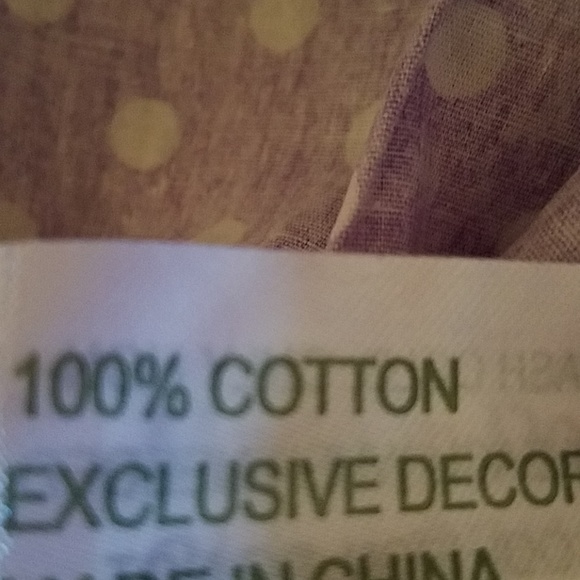
The image size is (580, 580). In order to click on "exclusive decor" in this screenshot , I will do `click(262, 485)`.